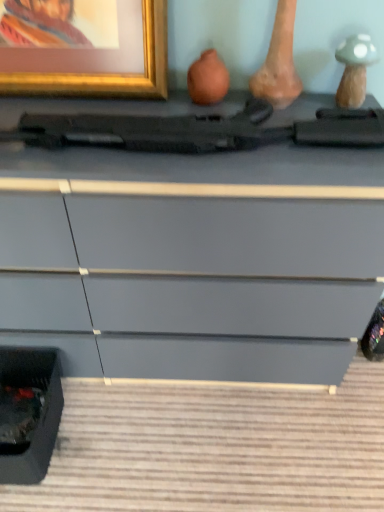
Question: Is gold metallic picture frame at upper left spatially inside matte gray chest of drawers at center, or outside of it?

Choices:
 (A) inside
 (B) outside

Answer: (B)

Question: Would you say gold metallic picture frame at upper left is to the left or to the right of matte gray chest of drawers at center in the picture?

Choices:
 (A) left
 (B) right

Answer: (A)

Question: Considering the real-world distances, which object is farthest from the gold metallic picture frame at upper left?

Choices:
 (A) matte gray chest of drawers at center
 (B) matte black gun at center

Answer: (A)

Question: Considering the real-world distances, which object is closest to the matte black gun at center?

Choices:
 (A) matte gray chest of drawers at center
 (B) gold metallic picture frame at upper left

Answer: (B)